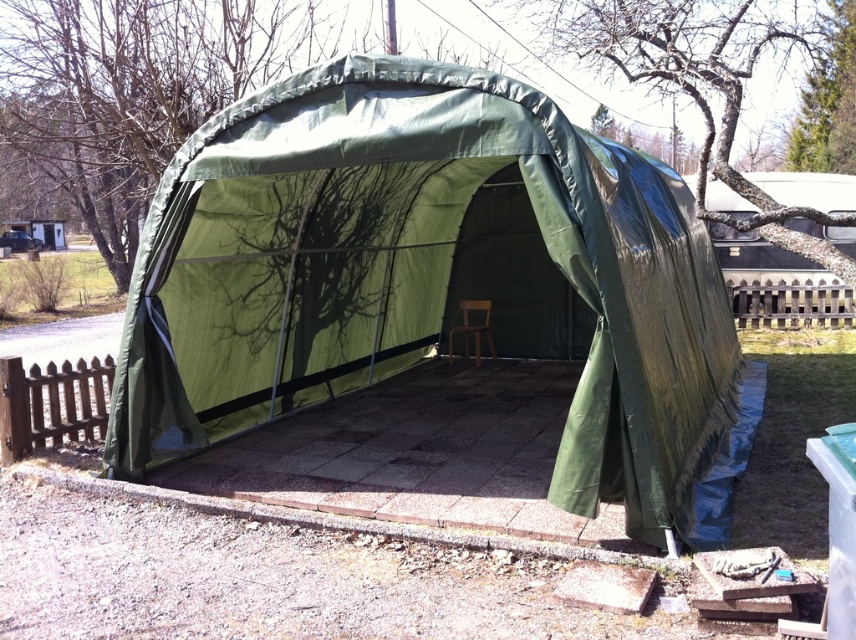
Question: Which object is farther from the camera taking this photo?

Choices:
 (A) brown matte chair at center
 (B) green fabric tent at center

Answer: (A)

Question: Which object appears farthest from the camera in this image?

Choices:
 (A) brown matte chair at center
 (B) green fabric tent at center

Answer: (A)

Question: Which of the following is the closest to the observer?

Choices:
 (A) (471, 301)
 (B) (205, 292)

Answer: (B)

Question: Does green fabric tent at center have a smaller size compared to brown matte chair at center?

Choices:
 (A) no
 (B) yes

Answer: (A)

Question: Does green fabric tent at center have a lesser width compared to brown matte chair at center?

Choices:
 (A) no
 (B) yes

Answer: (A)

Question: Is the position of green fabric tent at center more distant than that of brown matte chair at center?

Choices:
 (A) yes
 (B) no

Answer: (B)